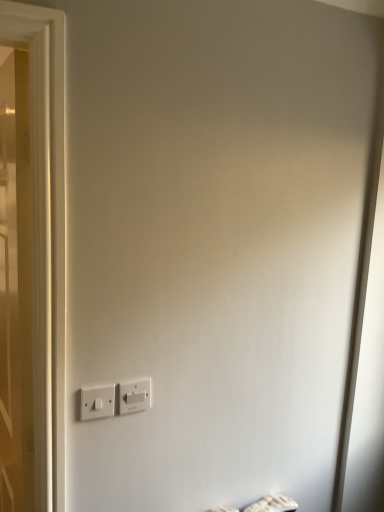
Question: Can you confirm if white wooden door at left is positioned to the left of white plastic power plugs and sockets at lower center, arranged as the 1th power plugs and sockets when viewed from the right?

Choices:
 (A) no
 (B) yes

Answer: (B)

Question: From the image's perspective, is white wooden door at left beneath white plastic power plugs and sockets at lower center, arranged as the 1th power plugs and sockets when viewed from the right?

Choices:
 (A) yes
 (B) no

Answer: (B)

Question: Considering the relative sizes of white wooden door at left and white plastic power plugs and sockets at lower center, the 2th power plugs and sockets when ordered from left to right, in the image provided, is white wooden door at left shorter than white plastic power plugs and sockets at lower center, the 2th power plugs and sockets when ordered from left to right,?

Choices:
 (A) no
 (B) yes

Answer: (A)

Question: Is white wooden door at left positioned far away from white plastic power plugs and sockets at lower center, the 2th power plugs and sockets when ordered from left to right?

Choices:
 (A) yes
 (B) no

Answer: (B)

Question: From a real-world perspective, is white wooden door at left beneath white plastic power plugs and sockets at lower center, the 2th power plugs and sockets when ordered from left to right?

Choices:
 (A) yes
 (B) no

Answer: (A)

Question: Does white wooden door at left have a greater width compared to white plastic power plugs and sockets at lower center, arranged as the 1th power plugs and sockets when viewed from the right?

Choices:
 (A) yes
 (B) no

Answer: (A)

Question: Is white wooden door at left to the left of white plastic power plugs and sockets at lower left, which is the first power plugs and sockets from left to right, from the viewer's perspective?

Choices:
 (A) yes
 (B) no

Answer: (A)

Question: Does white wooden door at left appear on the right side of white plastic power plugs and sockets at lower left, which is counted as the second power plugs and sockets, starting from the right?

Choices:
 (A) yes
 (B) no

Answer: (B)

Question: Is white wooden door at left taller than white plastic power plugs and sockets at lower left, which is the first power plugs and sockets from left to right?

Choices:
 (A) no
 (B) yes

Answer: (B)

Question: From a real-world perspective, is white wooden door at left on top of white plastic power plugs and sockets at lower left, which is counted as the second power plugs and sockets, starting from the right?

Choices:
 (A) no
 (B) yes

Answer: (A)

Question: Is white wooden door at left oriented towards white plastic power plugs and sockets at lower left, which is counted as the second power plugs and sockets, starting from the right?

Choices:
 (A) no
 (B) yes

Answer: (A)

Question: From a real-world perspective, is white wooden door at left located beneath white plastic power plugs and sockets at lower left, which is the first power plugs and sockets from left to right?

Choices:
 (A) no
 (B) yes

Answer: (B)

Question: From a real-world perspective, is white plastic power plugs and sockets at lower left, which is the first power plugs and sockets from left to right, positioned under white wooden door at left based on gravity?

Choices:
 (A) yes
 (B) no

Answer: (B)